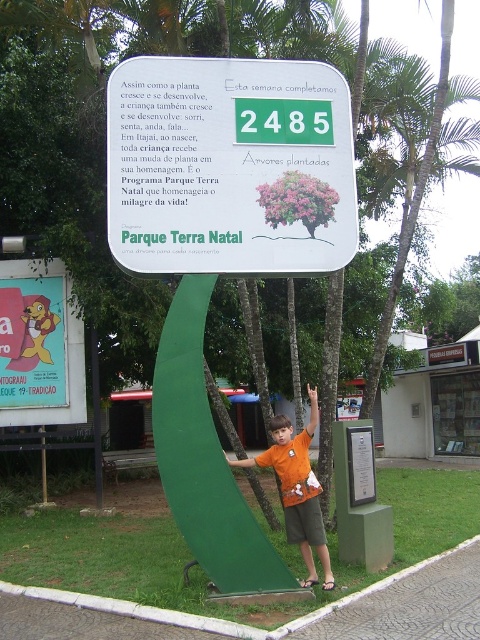
Question: Is white plastic sign at center positioned before orange cotton shirt at center?

Choices:
 (A) yes
 (B) no

Answer: (B)

Question: Which point is closer to the camera?

Choices:
 (A) (119, 234)
 (B) (310, 522)

Answer: (B)

Question: Which of the following is the closest to the observer?

Choices:
 (A) (286, 518)
 (B) (227, 129)

Answer: (A)

Question: In this image, where is white plastic sign at center located relative to orange cotton shirt at center?

Choices:
 (A) left
 (B) right

Answer: (A)

Question: Where is white plastic sign at center located in relation to orange cotton shirt at center in the image?

Choices:
 (A) left
 (B) right

Answer: (A)